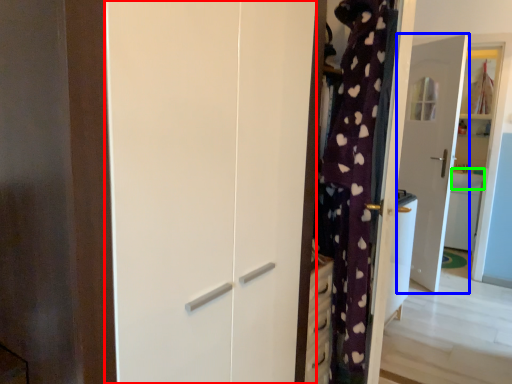
Question: Which object is positioned farthest from screen door (highlighted by a red box)? Select from door (highlighted by a blue box) and counter top (highlighted by a green box).

Choices:
 (A) door
 (B) counter top

Answer: (B)